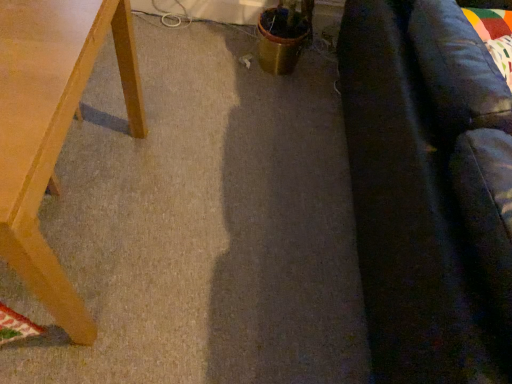
Question: Is dark gray fabric couch at right oriented away from light brown wooden table at left?

Choices:
 (A) yes
 (B) no

Answer: (A)

Question: Is dark gray fabric couch at right thinner than light brown wooden table at left?

Choices:
 (A) yes
 (B) no

Answer: (B)

Question: Can you confirm if dark gray fabric couch at right is taller than light brown wooden table at left?

Choices:
 (A) yes
 (B) no

Answer: (A)

Question: Does dark gray fabric couch at right come behind light brown wooden table at left?

Choices:
 (A) yes
 (B) no

Answer: (B)

Question: Does dark gray fabric couch at right have a larger size compared to light brown wooden table at left?

Choices:
 (A) yes
 (B) no

Answer: (A)

Question: Does dark gray fabric couch at right appear on the left side of light brown wooden table at left?

Choices:
 (A) yes
 (B) no

Answer: (B)

Question: Is light brown wooden table at left looking in the opposite direction of dark gray fabric couch at right?

Choices:
 (A) yes
 (B) no

Answer: (B)

Question: Is there a large distance between light brown wooden table at left and dark gray fabric couch at right?

Choices:
 (A) yes
 (B) no

Answer: (B)

Question: Does light brown wooden table at left appear on the right side of dark gray fabric couch at right?

Choices:
 (A) no
 (B) yes

Answer: (A)

Question: From a real-world perspective, is light brown wooden table at left below dark gray fabric couch at right?

Choices:
 (A) no
 (B) yes

Answer: (B)

Question: Is light brown wooden table at left thinner than dark gray fabric couch at right?

Choices:
 (A) yes
 (B) no

Answer: (A)

Question: Considering the relative sizes of light brown wooden table at left and dark gray fabric couch at right in the image provided, is light brown wooden table at left wider than dark gray fabric couch at right?

Choices:
 (A) no
 (B) yes

Answer: (A)

Question: Is dark gray fabric couch at right inside the boundaries of light brown wooden table at left, or outside?

Choices:
 (A) inside
 (B) outside

Answer: (B)